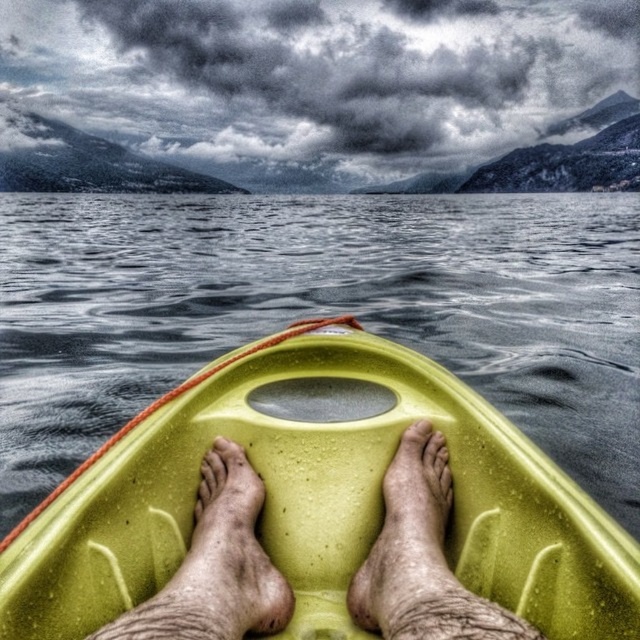
You are in a kayak on a calm lake, and you notice two points in the scene. One is at coordinate point (262, 364) and the other at point (394, 582). If you want to reach the closer point to your current position, which coordinate should you head towards?

Point (394, 582) is closer to your current position because it is less further to the camera than point (262, 364), which is further away.

You are in a kayak and want to move forward. There are two kayaks in front of you, a green matte kayak at center and a matte yellow kayak at center. Which one is closer to you?

The green matte kayak at center is closer to you because it is positioned in front of the matte yellow kayak at center.

From the picture: You are in a kayak on a calm lake surrounded by mountains. You notice two kayaks ahead of you. One is a green matte kayak at center and the other is a matte yellow kayak at center. Which one is positioned to the left when looking from your current viewpoint?

The green matte kayak at center is positioned to the left of the matte yellow kayak at center.